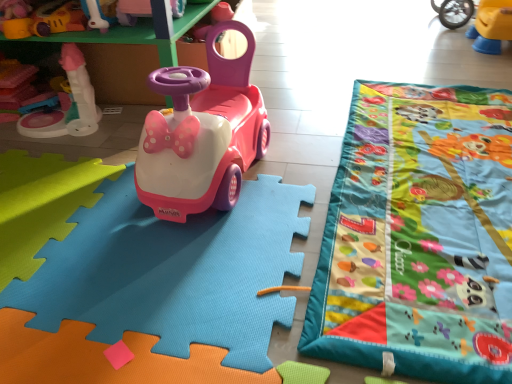
Question: Does pink plastic car at center, the 1th toy ordered from the bottom, have a greater width compared to matte plastic toy at upper left, the third toy from the top?

Choices:
 (A) yes
 (B) no

Answer: (A)

Question: Could you tell me if pink plastic car at center, the 1th toy ordered from the bottom, is turned towards matte plastic toy at upper left, the third toy from the top?

Choices:
 (A) yes
 (B) no

Answer: (B)

Question: Is pink plastic car at center, the 1th toy ordered from the bottom, next to matte plastic toy at upper left, acting as the 3th toy starting from the bottom, and touching it?

Choices:
 (A) yes
 (B) no

Answer: (B)

Question: Does pink plastic car at center, the 1th toy ordered from the bottom, have a lesser height compared to matte plastic toy at upper left, the third toy from the top?

Choices:
 (A) no
 (B) yes

Answer: (B)

Question: From the image's perspective, is pink plastic car at center, which is the 5th toy in top-to-bottom order, located above matte plastic toy at upper left, the third toy from the top?

Choices:
 (A) no
 (B) yes

Answer: (A)

Question: In the image, is pink plastic toy car at center, arranged as the fifth toy when ordered from the bottom, on the left side or the right side of matte plastic toy at upper left, acting as the 3th toy starting from the bottom?

Choices:
 (A) left
 (B) right

Answer: (B)

Question: From a real-world perspective, is pink plastic toy car at center, the 1th toy viewed from the top, physically located above or below matte plastic toy at upper left, acting as the 3th toy starting from the bottom?

Choices:
 (A) below
 (B) above

Answer: (A)

Question: Choose the correct answer: Is pink plastic toy car at center, arranged as the fifth toy when ordered from the bottom, inside matte plastic toy at upper left, the third toy from the top, or outside it?

Choices:
 (A) outside
 (B) inside

Answer: (A)

Question: From the image's perspective, relative to matte plastic toy at upper left, the third toy from the top, is pink plastic toy car at center, the 1th toy viewed from the top, above or below?

Choices:
 (A) above
 (B) below

Answer: (A)

Question: From their relative heights in the image, would you say matte plastic toy car at upper center, the second toy positioned from the top, is taller or shorter than pink plastic car at center, which is the 5th toy in top-to-bottom order?

Choices:
 (A) short
 (B) tall

Answer: (B)

Question: From a real-world perspective, is matte plastic toy car at upper center, the second toy positioned from the top, physically located above or below pink plastic car at center, which is the 5th toy in top-to-bottom order?

Choices:
 (A) above
 (B) below

Answer: (A)

Question: Looking at their shapes, would you say matte plastic toy car at upper center, positioned as the 4th toy in bottom-to-top order, is wider or thinner than pink plastic car at center, the 1th toy ordered from the bottom?

Choices:
 (A) wide
 (B) thin

Answer: (B)

Question: Based on their positions, is matte plastic toy car at upper center, the second toy positioned from the top, located to the left or right of pink plastic car at center, which is the 5th toy in top-to-bottom order?

Choices:
 (A) right
 (B) left

Answer: (B)

Question: Is point (183, 211) positioned closer to the camera than point (88, 102)?

Choices:
 (A) farther
 (B) closer

Answer: (B)

Question: Based on their sizes in the image, would you say pink plastic toy car at center is bigger or smaller than matte plastic toy at left, placed as the 2th toy when sorted from bottom to top?

Choices:
 (A) small
 (B) big

Answer: (B)